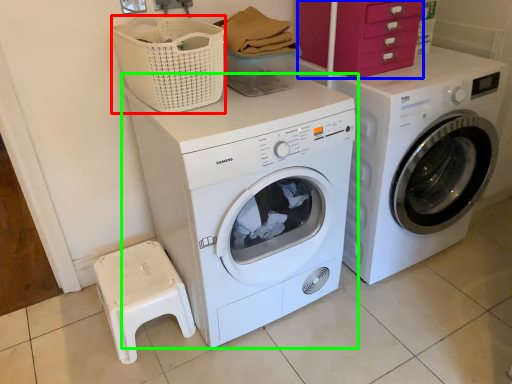
Question: Which object is the farthest from basket (highlighted by a red box)? Choose among these: drawer (highlighted by a blue box) or washing machine (highlighted by a green box).

Choices:
 (A) drawer
 (B) washing machine

Answer: (A)